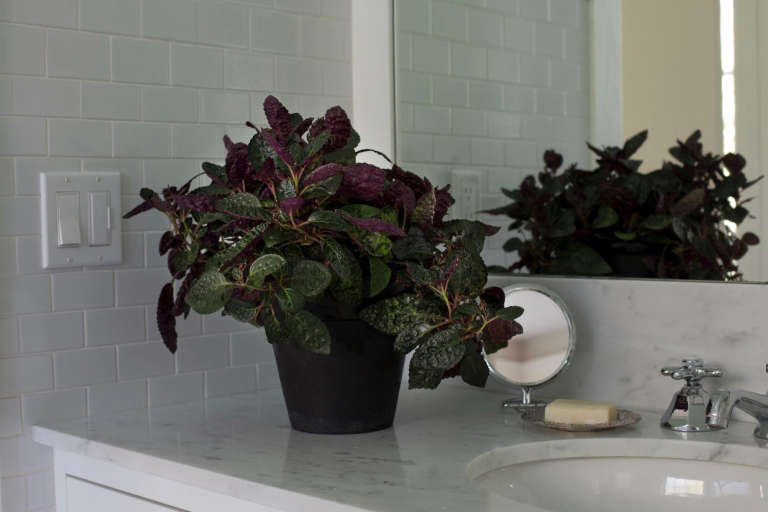
At what (x,y) coordinates should I click in order to perform the action: click on mirror. Please return your answer as a coordinate pair (x, y). Looking at the image, I should click on (543, 336).